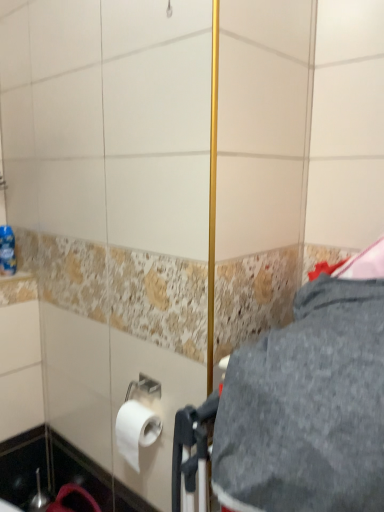
Question: Is blue plastic bottle at left at the back of white matte toilet paper at lower left?

Choices:
 (A) no
 (B) yes

Answer: (A)

Question: Considering the relative sizes of white matte toilet paper at lower left and blue plastic bottle at left in the image provided, is white matte toilet paper at lower left thinner than blue plastic bottle at left?

Choices:
 (A) yes
 (B) no

Answer: (B)

Question: Is white matte toilet paper at lower left behind blue plastic bottle at left?

Choices:
 (A) no
 (B) yes

Answer: (A)

Question: Does white matte toilet paper at lower left have a greater height compared to blue plastic bottle at left?

Choices:
 (A) no
 (B) yes

Answer: (A)

Question: Is white matte toilet paper at lower left not close to blue plastic bottle at left?

Choices:
 (A) no
 (B) yes

Answer: (A)

Question: Looking at the image, does blue plastic bottle at left seem bigger or smaller compared to gray fabric at center?

Choices:
 (A) small
 (B) big

Answer: (A)

Question: Is point (6, 260) positioned closer to the camera than point (321, 431)?

Choices:
 (A) closer
 (B) farther

Answer: (B)

Question: Considering the positions of blue plastic bottle at left and gray fabric at center in the image, is blue plastic bottle at left wider or thinner than gray fabric at center?

Choices:
 (A) wide
 (B) thin

Answer: (B)

Question: In terms of height, does blue plastic bottle at left look taller or shorter compared to gray fabric at center?

Choices:
 (A) tall
 (B) short

Answer: (B)

Question: Is white matte toilet paper at lower left spatially inside gray fabric at center, or outside of it?

Choices:
 (A) outside
 (B) inside

Answer: (A)

Question: Is point (130, 408) closer or farther from the camera than point (311, 464)?

Choices:
 (A) farther
 (B) closer

Answer: (A)

Question: Looking at their shapes, would you say white matte toilet paper at lower left is wider or thinner than gray fabric at center?

Choices:
 (A) thin
 (B) wide

Answer: (A)

Question: From the image's perspective, is white matte toilet paper at lower left located above or below gray fabric at center?

Choices:
 (A) below
 (B) above

Answer: (A)

Question: Is point (321, 406) positioned closer to the camera than point (135, 433)?

Choices:
 (A) farther
 (B) closer

Answer: (B)

Question: Based on their positions, is gray fabric at center located to the left or right of white matte toilet paper at lower left?

Choices:
 (A) left
 (B) right

Answer: (B)